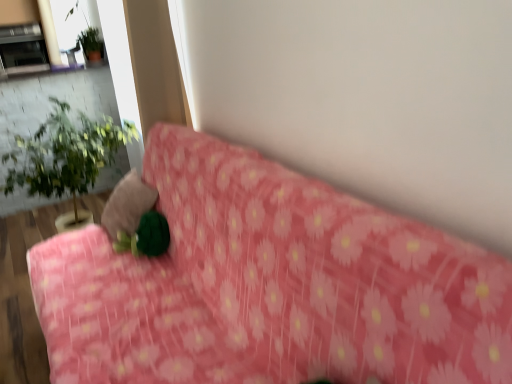
Question: Does velvety green pillow at center turn towards pink floral fabric at center?

Choices:
 (A) no
 (B) yes

Answer: (B)

Question: Is velvety green pillow at center to the right of pink floral fabric at center from the viewer's perspective?

Choices:
 (A) yes
 (B) no

Answer: (B)

Question: Is velvety green pillow at center with pink floral fabric at center?

Choices:
 (A) yes
 (B) no

Answer: (B)

Question: Is the depth of velvety green pillow at center less than that of pink floral fabric at center?

Choices:
 (A) no
 (B) yes

Answer: (A)

Question: From a real-world perspective, is velvety green pillow at center under pink floral fabric at center?

Choices:
 (A) yes
 (B) no

Answer: (B)

Question: From the image's perspective, is green leafy plant at left above or below velvety green pillow at center?

Choices:
 (A) below
 (B) above

Answer: (B)

Question: From a real-world perspective, is green leafy plant at left physically located above or below velvety green pillow at center?

Choices:
 (A) below
 (B) above

Answer: (B)

Question: In terms of height, does green leafy plant at left look taller or shorter compared to velvety green pillow at center?

Choices:
 (A) tall
 (B) short

Answer: (A)

Question: Is point (70, 125) positioned closer to the camera than point (116, 210)?

Choices:
 (A) farther
 (B) closer

Answer: (A)

Question: Is pink floral fabric at center spatially inside green leafy plant at left, or outside of it?

Choices:
 (A) outside
 (B) inside

Answer: (A)

Question: Is pink floral fabric at center in front of or behind green leafy plant at left in the image?

Choices:
 (A) front
 (B) behind

Answer: (A)

Question: Considering the positions of pink floral fabric at center and green leafy plant at left in the image, is pink floral fabric at center wider or thinner than green leafy plant at left?

Choices:
 (A) thin
 (B) wide

Answer: (A)

Question: From the image's perspective, is pink floral fabric at center above or below green leafy plant at left?

Choices:
 (A) below
 (B) above

Answer: (A)

Question: Based on their sizes in the image, would you say metallic silver fireplace at upper left is bigger or smaller than pink floral fabric at center?

Choices:
 (A) small
 (B) big

Answer: (A)

Question: From the image's perspective, relative to pink floral fabric at center, is metallic silver fireplace at upper left above or below?

Choices:
 (A) below
 (B) above

Answer: (B)